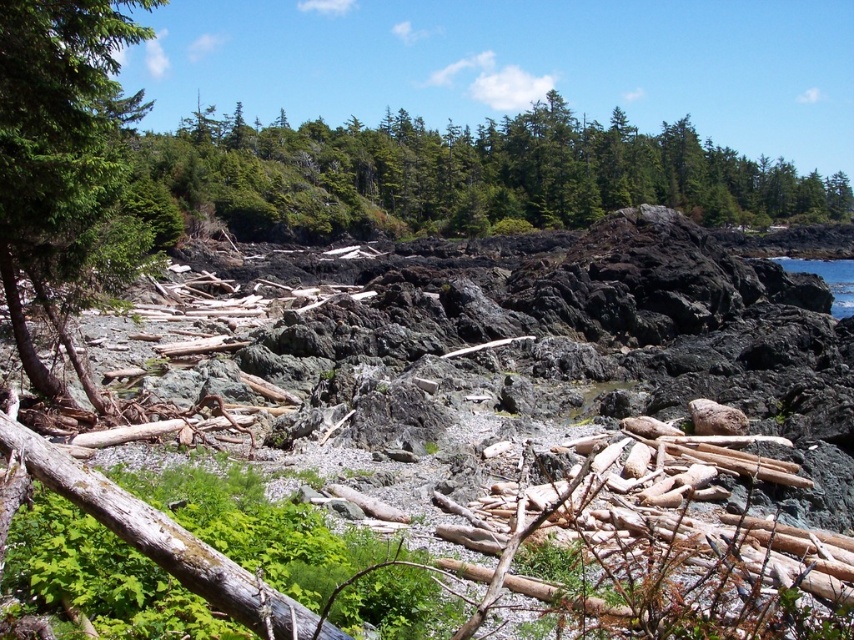
Question: Which object is positioned farthest from the green textured trees at upper center?

Choices:
 (A) black rock at center
 (B) green matte tree at left
 (C) blue water at upper right

Answer: (B)

Question: Is green textured trees at upper center to the left of blue water at upper right from the viewer's perspective?

Choices:
 (A) no
 (B) yes

Answer: (B)

Question: Is green textured trees at upper center further to camera compared to blue water at upper right?

Choices:
 (A) yes
 (B) no

Answer: (A)

Question: Which of the following is the closest to the observer?

Choices:
 (A) (794, 268)
 (B) (506, 538)
 (C) (243, 196)

Answer: (B)

Question: Which object is closer to the camera taking this photo?

Choices:
 (A) blue water at upper right
 (B) green matte tree at left
 (C) green textured trees at upper center
 (D) black rock at center

Answer: (D)

Question: Is black rock at center in front of green textured trees at upper center?

Choices:
 (A) no
 (B) yes

Answer: (B)